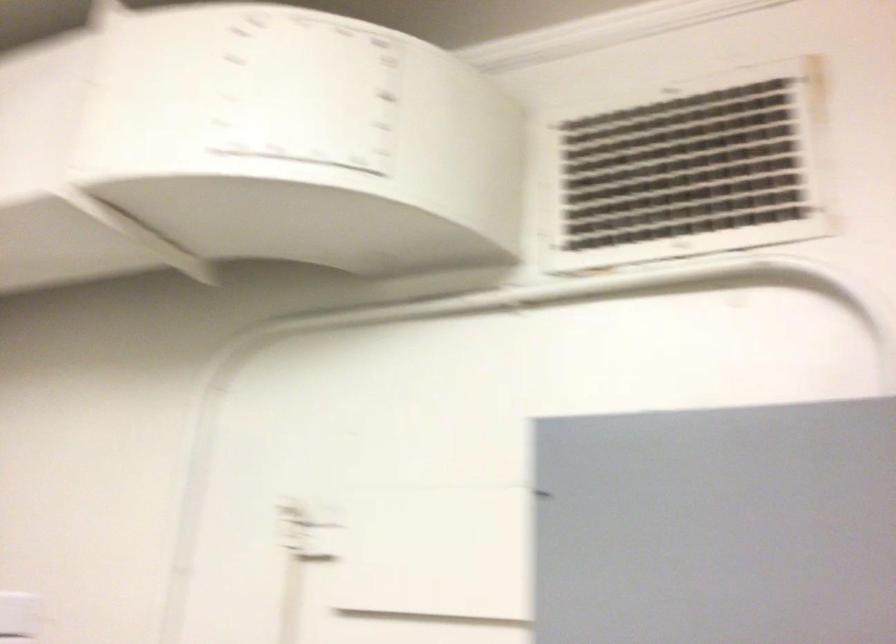
Describe the element at coordinates (686, 169) in the screenshot. This screenshot has height=644, width=896. I see `a white duct panel` at that location.